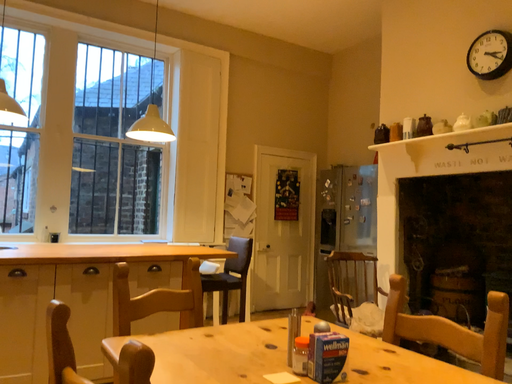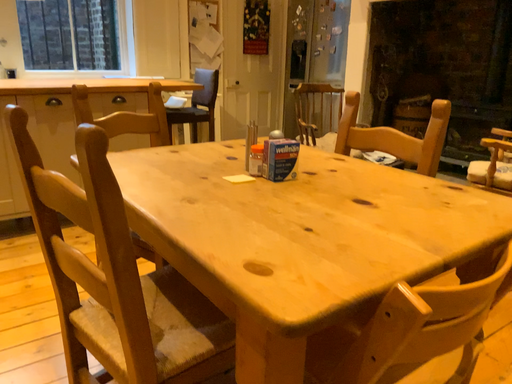
Question: Which way did the camera rotate in the video?

Choices:
 (A) rotated upward
 (B) rotated downward

Answer: (B)